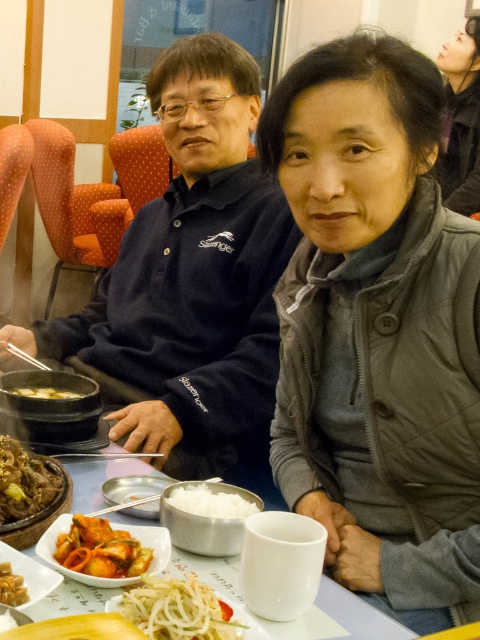
How much distance is there between brown clay pot at lower left and metallic silver chopsticks at center?

They are 6.90 inches apart.

Can you confirm if brown clay pot at lower left is thinner than metallic silver chopsticks at center?

Correct, brown clay pot at lower left's width is less than metallic silver chopsticks at center's.

Where is `brown clay pot at lower left`? brown clay pot at lower left is located at coordinates (24, 481).

This screenshot has width=480, height=640. What are the coordinates of `brown clay pot at lower left` in the screenshot? It's located at (24, 481).

Is point (112, 561) farther from viewer compared to point (13, 593)?

That is True.

Where is `vibrant orange sauce at center`? vibrant orange sauce at center is located at coordinates (100, 548).

Who is higher up, matte ceramic bowl at center or metallic silver chopsticks at center?

matte ceramic bowl at center is above.

Between point (57, 429) and point (63, 452), which one is positioned behind?

Point (57, 429)

Identify the location of matte ceramic bowl at center. (48, 404).